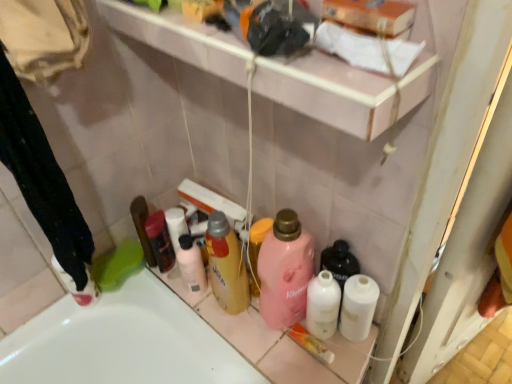
Question: From a real-world perspective, is white paper towel at upper center physically below pink glossy shelf at upper center?

Choices:
 (A) yes
 (B) no

Answer: (B)

Question: From a real-world perspective, is white paper towel at upper center on pink glossy shelf at upper center?

Choices:
 (A) yes
 (B) no

Answer: (A)

Question: Is white paper towel at upper center smaller than pink glossy shelf at upper center?

Choices:
 (A) no
 (B) yes

Answer: (B)

Question: Is white paper towel at upper center at the left side of pink glossy shelf at upper center?

Choices:
 (A) yes
 (B) no

Answer: (B)

Question: Can you confirm if white paper towel at upper center is thinner than pink glossy shelf at upper center?

Choices:
 (A) yes
 (B) no

Answer: (A)

Question: Can you confirm if white paper towel at upper center is shorter than pink glossy shelf at upper center?

Choices:
 (A) yes
 (B) no

Answer: (A)

Question: From the image's perspective, would you say white plastic bottle at center, the third toiletry from the right, is positioned over pink glossy shelf at upper center?

Choices:
 (A) no
 (B) yes

Answer: (A)

Question: From the image's perspective, is white plastic bottle at center, the third toiletry from the right, located beneath pink glossy shelf at upper center?

Choices:
 (A) yes
 (B) no

Answer: (A)

Question: Is white plastic bottle at center, the third toiletry from the right, smaller than pink glossy shelf at upper center?

Choices:
 (A) yes
 (B) no

Answer: (A)

Question: Does white plastic bottle at center, the third toiletry from the right, have a larger size compared to pink glossy shelf at upper center?

Choices:
 (A) yes
 (B) no

Answer: (B)

Question: Is white plastic bottle at center, acting as the third toiletry starting from the left, oriented towards pink glossy shelf at upper center?

Choices:
 (A) no
 (B) yes

Answer: (A)

Question: Is white plastic bottle at center, acting as the third toiletry starting from the left, with pink glossy shelf at upper center?

Choices:
 (A) no
 (B) yes

Answer: (A)

Question: Is the position of white paper towel at upper center more distant than that of pink matte bottle at center, the first cleaning product positioned from the right?

Choices:
 (A) yes
 (B) no

Answer: (B)